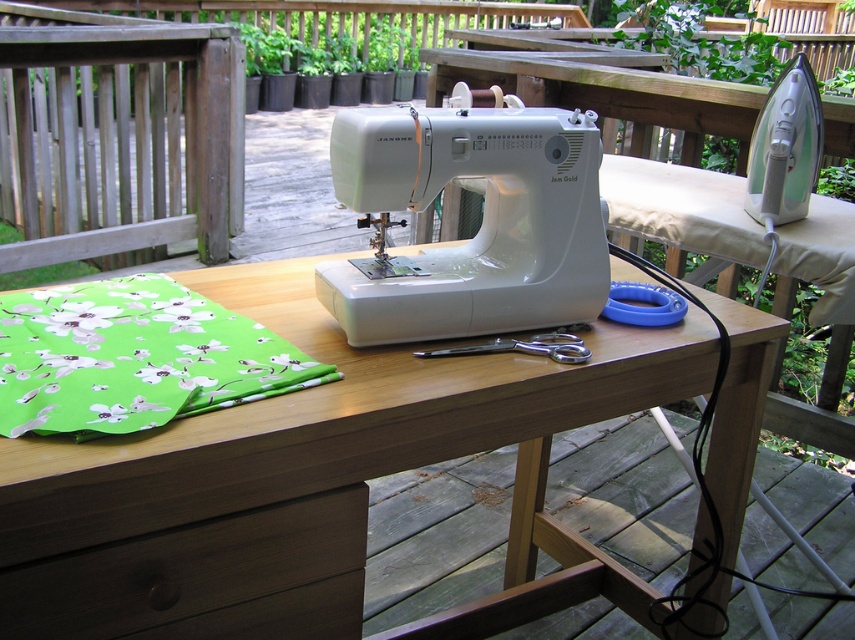
Question: Does white plastic sewing machine at center have a greater width compared to dark brown wood drawer at lower left?

Choices:
 (A) no
 (B) yes

Answer: (B)

Question: Can you confirm if dark brown wood drawer at lower left is thinner than green floral fabric at lower left?

Choices:
 (A) no
 (B) yes

Answer: (B)

Question: Considering the real-world distances, which object is closest to the green floral fabric at lower left?

Choices:
 (A) white plastic sewing machine at center
 (B) wooden table at center

Answer: (B)

Question: Does white plastic sewing machine at center come behind dark brown wood drawer at lower left?

Choices:
 (A) no
 (B) yes

Answer: (B)

Question: Which of the following is the farthest from the observer?

Choices:
 (A) (140, 346)
 (B) (329, 326)
 (C) (535, 150)
 (D) (128, 582)

Answer: (B)

Question: Which of the following is the farthest from the observer?

Choices:
 (A) (478, 148)
 (B) (567, 540)
 (C) (121, 372)

Answer: (B)